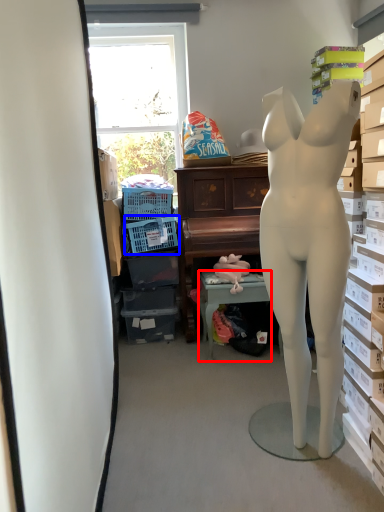
Question: Which of the following is the closest to the observer, table (highlighted by a red box) or laundry basket (highlighted by a blue box)?

Choices:
 (A) table
 (B) laundry basket

Answer: (A)